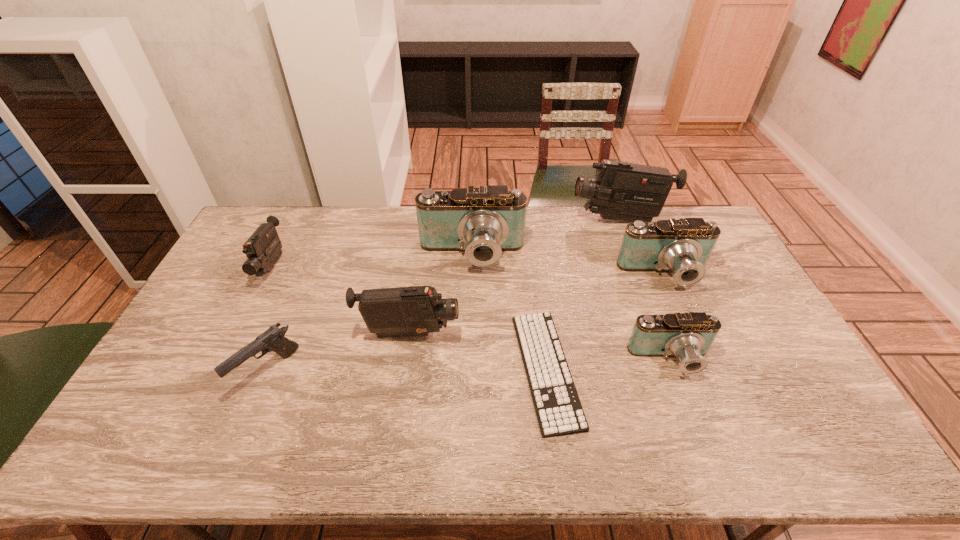
Image resolution: width=960 pixels, height=540 pixels. Find the location of `vacant space at the far left corner of the desktop`. vacant space at the far left corner of the desktop is located at coordinates (281, 219).

Where is `free space between the leftmost blue camcorder and the smallest blue camcorder`? free space between the leftmost blue camcorder and the smallest blue camcorder is located at coordinates (571, 308).

At what (x,y) coordinates should I click in order to perform the action: click on free spot between the farthest object and the second biggest black camcorder. Please return your answer as a coordinate pair (x, y). This screenshot has height=540, width=960. Looking at the image, I should click on (514, 277).

Image resolution: width=960 pixels, height=540 pixels. Find the location of `vacant area that lies between the nearest black camcorder and the computer keyboard`. vacant area that lies between the nearest black camcorder and the computer keyboard is located at coordinates (478, 352).

You are a GUI agent. You are given a task and a screenshot of the screen. Output one action in this format:
    pyautogui.click(x=<x>, y=<y>)
    Task: Click on the free point between the second nearest black camcorder and the gun
    The image size is (960, 540).
    Given the screenshot: What is the action you would take?
    pyautogui.click(x=269, y=319)

Locate an element on the screen. This screenshot has width=960, height=540. free space between the leftmost black camcorder and the gun is located at coordinates pos(269,319).

I want to click on vacant space that's between the biggest blue camcorder and the computer keyboard, so click(509, 312).

Find the location of `vacant space that's between the farthest object and the second black camcorder from right to left`. vacant space that's between the farthest object and the second black camcorder from right to left is located at coordinates (514, 277).

Find the location of a particular element. free area in between the computer keyboard and the farthest black camcorder is located at coordinates (583, 295).

Where is `the third closest object to the second biggest blue camcorder`? the third closest object to the second biggest blue camcorder is located at coordinates (559, 412).